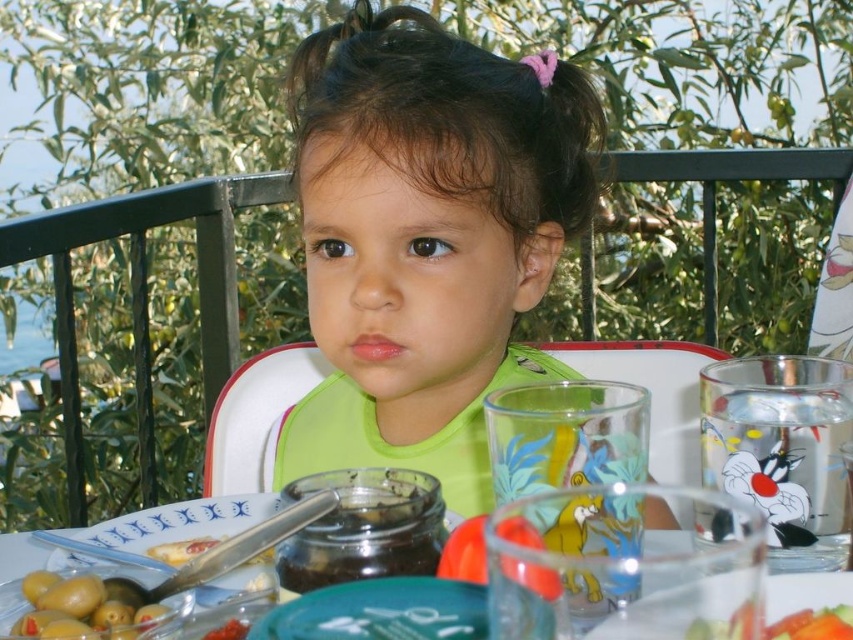
Consider the image. You are a parent looking at the table where your child is sitting. You want to place a small toy between the clear glass platter at lower right and the yellow creamy spread at lower left. Based on their positions, will the toy be closer to the platter or the spread?

The clear glass platter at lower right is closer to the viewer than the yellow creamy spread at lower left, so the toy will be closer to the platter.

You are a parent preparing snacks for your child. You have a clear glass platter at lower right and a yellow creamy spread at lower left. Which item should you choose to serve a slice of bread?

The clear glass platter at lower right is wider than the yellow creamy spread at lower left, so it would be more suitable for serving a slice of bread as it provides a larger surface area.